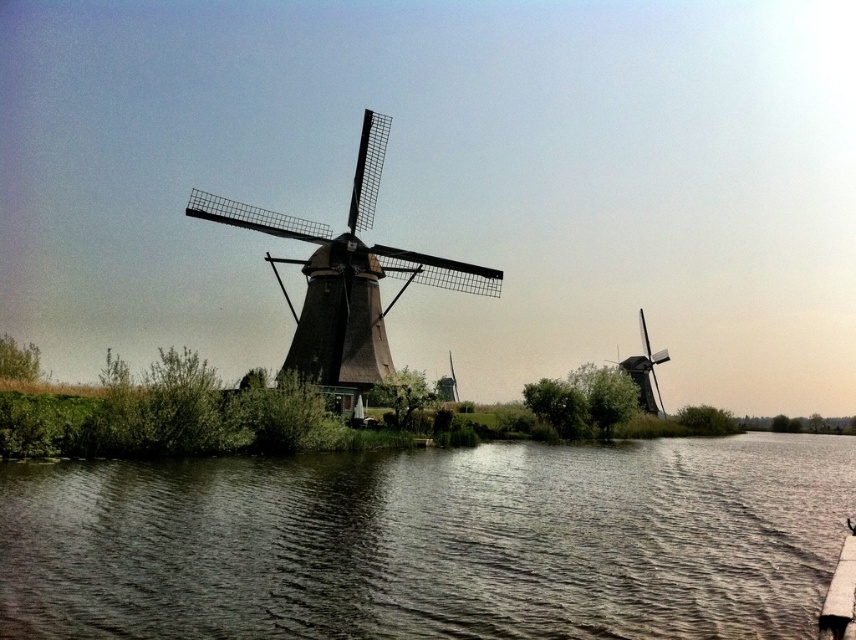
You are standing on the bank of the water and want to look at the brown thatched roof windmill at center. Which direction should you look relative to the dark water at center?

The dark water at center is below the brown thatched roof windmill at center, so you should look upward from the dark water at center to see the brown thatched roof windmill at center.

You are standing at the edge of the water and want to take a photo of the brown thatched roof windmill at center without the dark water at center blocking the view. Which direction should you move to ensure the windmill is fully visible?

You should move backward away from the dark water at center so that the brown thatched roof windmill at center comes into view without obstruction from the water.